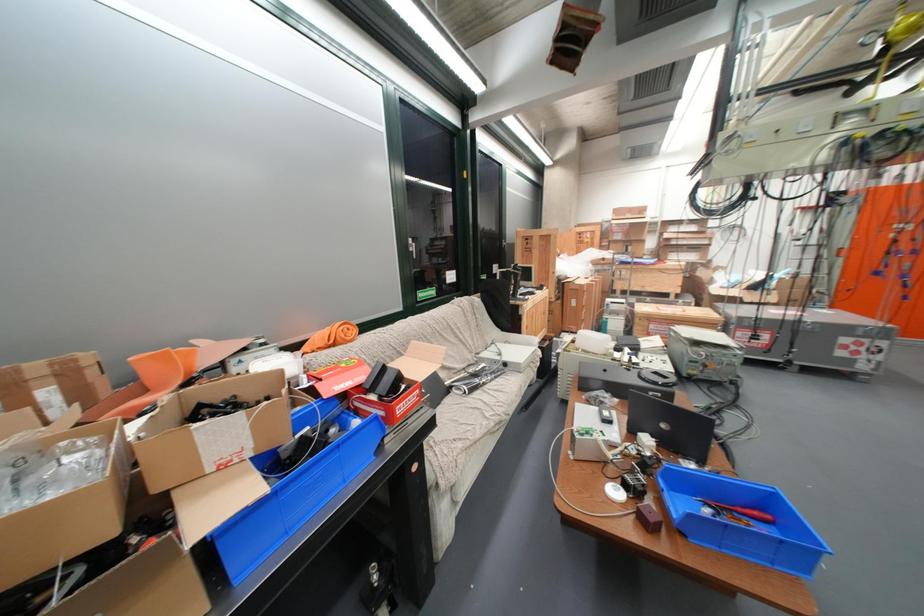
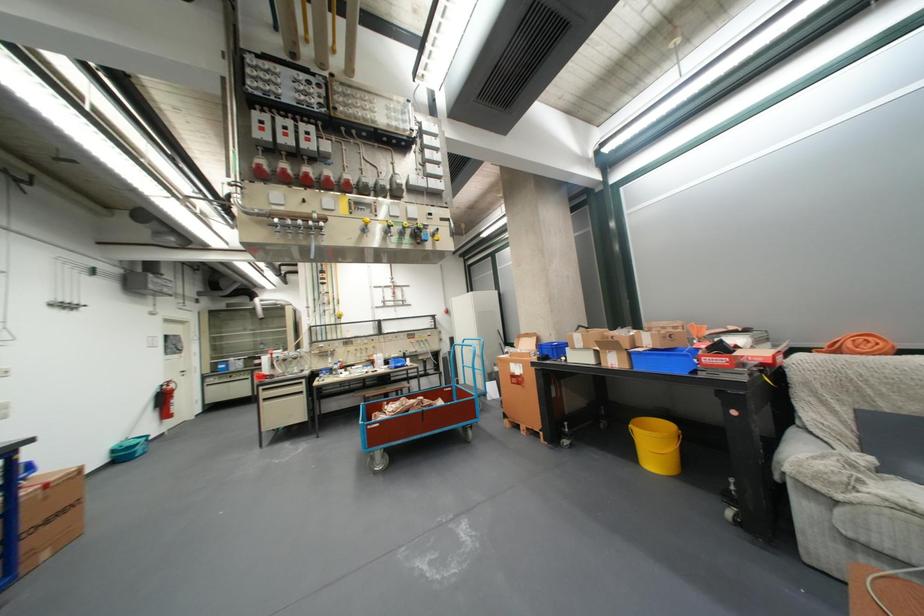
Find the pixel in the second image that matches [346,345] in the first image.

(849, 352)